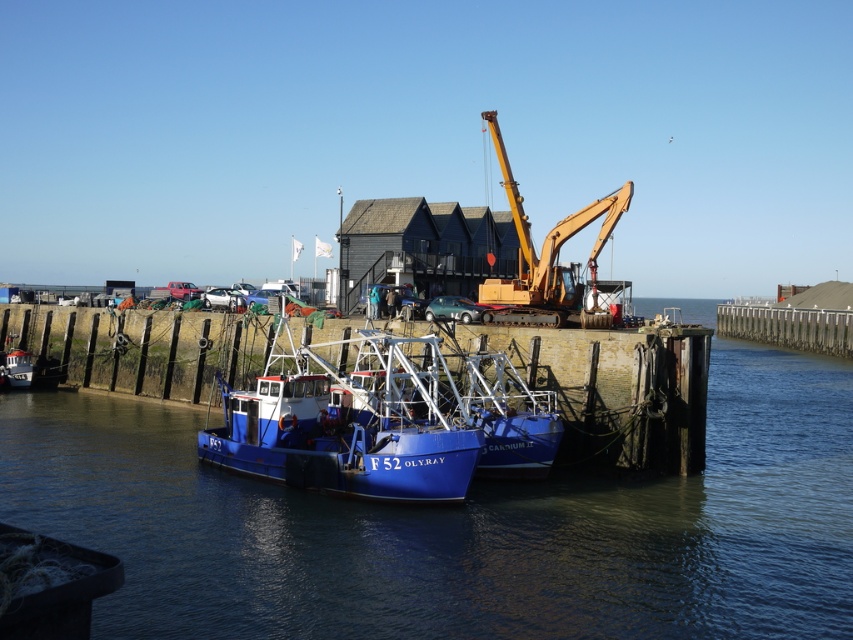
Question: Does blue water at center have a lesser width compared to blue matte boat at center?

Choices:
 (A) no
 (B) yes

Answer: (A)

Question: Is blue water at center below blue matte boat at center?

Choices:
 (A) no
 (B) yes

Answer: (B)

Question: Which of the following is the closest to the observer?

Choices:
 (A) blue water at center
 (B) blue matte boat at center

Answer: (A)

Question: Is blue water at center thinner than blue matte boat at center?

Choices:
 (A) yes
 (B) no

Answer: (B)